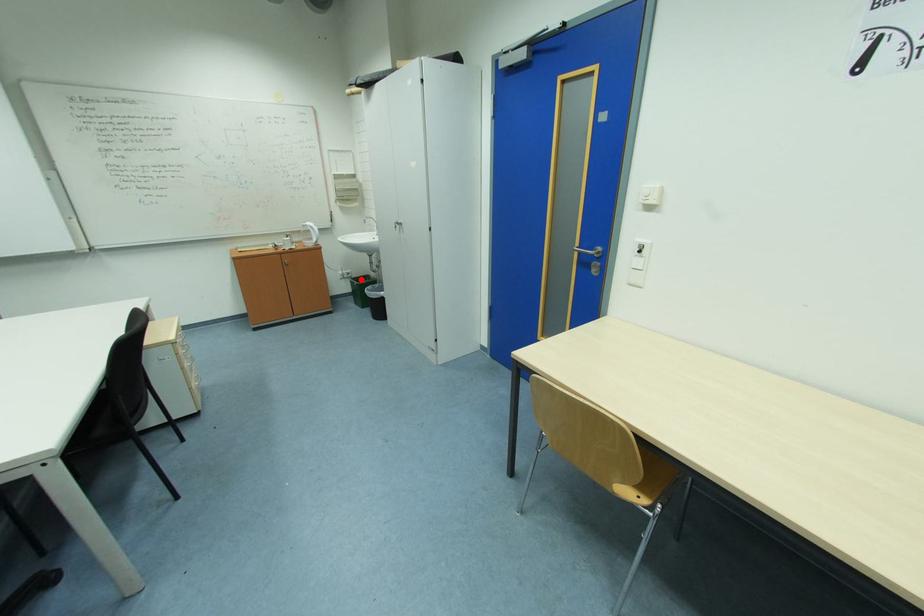
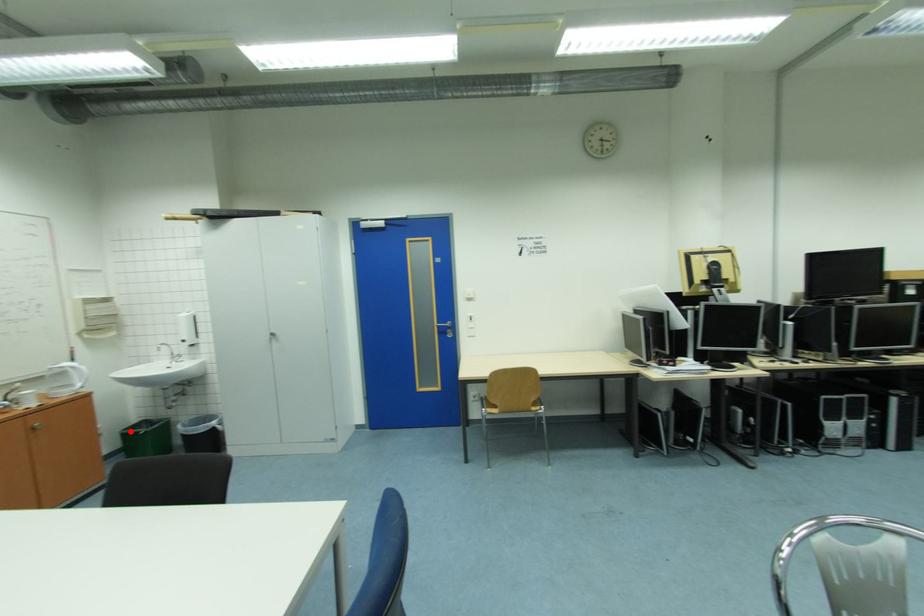
I am providing you with two images of the same scene from different viewpoints. A red point is marked on the first image and another point is marked on the second image. Is the marked point in image1 the same physical position as the marked point in image2?

Yes